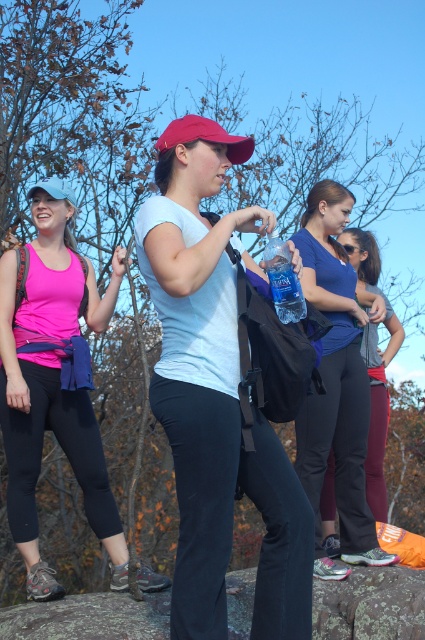
Question: Estimate the real-world distances between objects in this image. Which object is farther from the matte white shirt at center?

Choices:
 (A) blue fabric baseball cap at upper left
 (B) pink fabric tank top at left

Answer: (A)

Question: Observing the image, what is the correct spatial positioning of dark blue fabric pants at center in reference to blue fabric baseball cap at upper left?

Choices:
 (A) right
 (B) left

Answer: (A)

Question: Which object is the farthest from the clear plastic bottle at center?

Choices:
 (A) smooth rock at center
 (B) blue fabric tank top at center
 (C) pink fabric tank top at left
 (D) blue fabric baseball cap at upper left

Answer: (A)

Question: Among these points, which one is nearest to the camera?

Choices:
 (A) (82, 435)
 (B) (51, 186)
 (C) (306, 314)
 (D) (181, 141)

Answer: (D)

Question: Is matte white shirt at center closer to camera compared to dark blue fabric pants at center?

Choices:
 (A) yes
 (B) no

Answer: (A)

Question: Is pink fabric tank top at left below dark blue fabric pants at center?

Choices:
 (A) no
 (B) yes

Answer: (B)